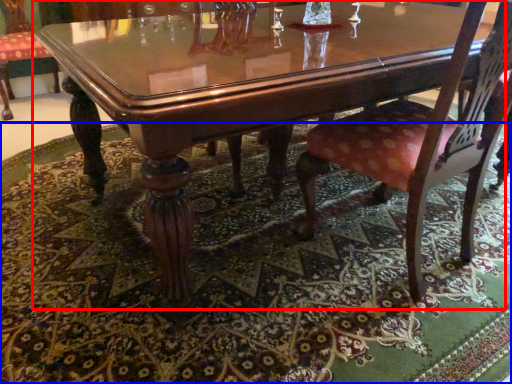
Question: Which object is further to the camera taking this photo, coffee table (highlighted by a red box) or place mat (highlighted by a blue box)?

Choices:
 (A) coffee table
 (B) place mat

Answer: (A)